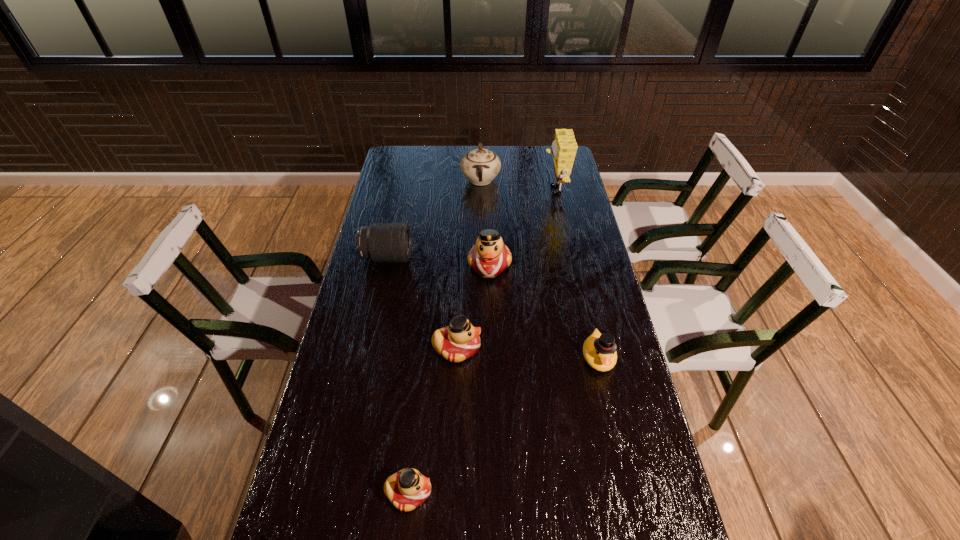
At what (x,y) coordinates should I click in order to perform the action: click on the smallest red duck. Please return your answer as a coordinate pair (x, y). This screenshot has width=960, height=540. Looking at the image, I should click on (407, 489).

In order to click on vacant area situated on the front-facing side of the sponge in this screenshot , I will do (x=467, y=190).

At what (x,y) coordinates should I click in order to perform the action: click on vacant space located 0.390m on the front-facing side of the sponge. Please return your answer as a coordinate pair (x, y). The image size is (960, 540). Looking at the image, I should click on (450, 190).

You are a GUI agent. You are given a task and a screenshot of the screen. Output one action in this format:
    pyautogui.click(x=<x>, y=<y>)
    Task: Click on the vacant space located on the front-facing side of the sponge
    The width and height of the screenshot is (960, 540).
    Given the screenshot: What is the action you would take?
    pyautogui.click(x=507, y=190)

You are a GUI agent. You are given a task and a screenshot of the screen. Output one action in this format:
    pyautogui.click(x=<x>, y=<y>)
    Task: Click on the vacant space located on the front of the chinaware
    
    Given the screenshot: What is the action you would take?
    pyautogui.click(x=481, y=205)

You are a GUI agent. You are given a task and a screenshot of the screen. Output one action in this format:
    pyautogui.click(x=<x>, y=<y>)
    Task: Click on the vacant region located 0.250m on the face of the farthest red duck
    This screenshot has height=540, width=960.
    Given the screenshot: What is the action you would take?
    pyautogui.click(x=492, y=342)

This screenshot has height=540, width=960. In order to click on blank area located on the surface of the telephoto lens in this screenshot , I will do `click(494, 258)`.

Identify the location of vacant region located on the face of the second farthest red duck. (545, 348).

You are a GUI agent. You are given a task and a screenshot of the screen. Output one action in this format:
    pyautogui.click(x=<x>, y=<y>)
    Task: Click on the free location located on the front-facing side of the rightmost duck
    The height and width of the screenshot is (540, 960).
    Given the screenshot: What is the action you would take?
    pyautogui.click(x=610, y=408)

You are a GUI agent. You are given a task and a screenshot of the screen. Output one action in this format:
    pyautogui.click(x=<x>, y=<y>)
    Task: Click on the vacant space situated on the face of the nearest red duck
    
    Given the screenshot: What is the action you would take?
    pyautogui.click(x=548, y=492)